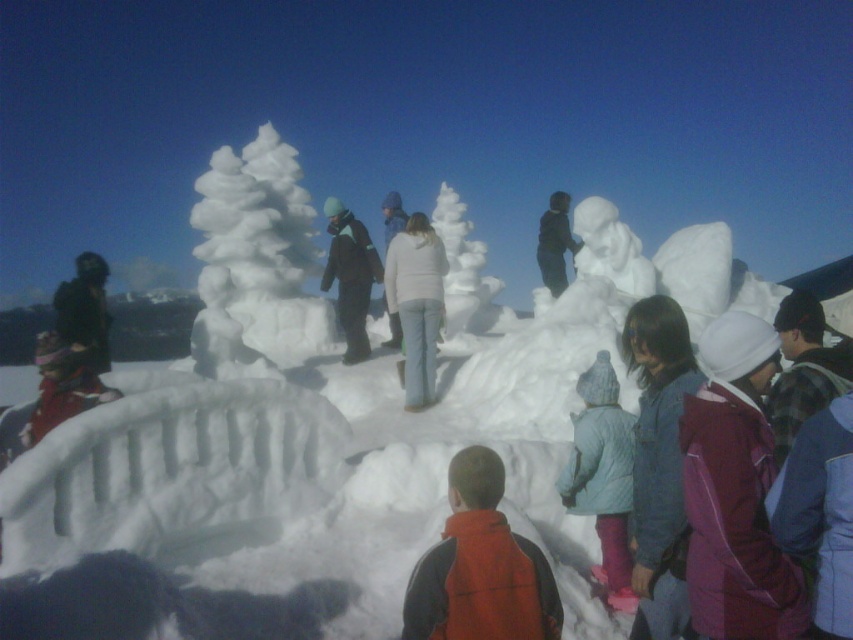
Question: Which point appears farthest from the camera in this image?

Choices:
 (A) (415, 328)
 (B) (601, 380)
 (C) (579, 244)
 (D) (349, 248)

Answer: (C)

Question: Among these objects, which one is farthest from the camera?

Choices:
 (A) white frosty tree at center
 (B) white matte jacket at center
 (C) black matte snowman at center

Answer: (C)

Question: Can you confirm if light blue quilted jacket at lower center is positioned above black matte snowman at center?

Choices:
 (A) yes
 (B) no

Answer: (B)

Question: Is white frosty tree at center bigger than orange fleece vest at center?

Choices:
 (A) no
 (B) yes

Answer: (B)

Question: Among these points, which one is farthest from the camera?

Choices:
 (A) pyautogui.click(x=415, y=410)
 (B) pyautogui.click(x=543, y=246)
 (C) pyautogui.click(x=595, y=220)
 (D) pyautogui.click(x=438, y=600)

Answer: (B)

Question: Can you confirm if orange fleece vest at center is thinner than white matte jacket at center?

Choices:
 (A) no
 (B) yes

Answer: (B)